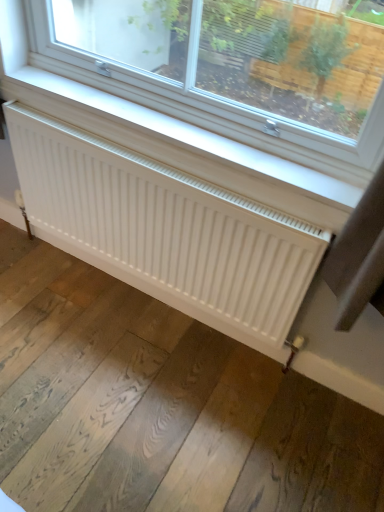
At what (x,y) coordinates should I click in order to perform the action: click on vacant space underneath white matte radiator at lower center (from a real-world perspective). Please return your answer as a coordinate pair (x, y). The width and height of the screenshot is (384, 512). Looking at the image, I should click on (134, 298).